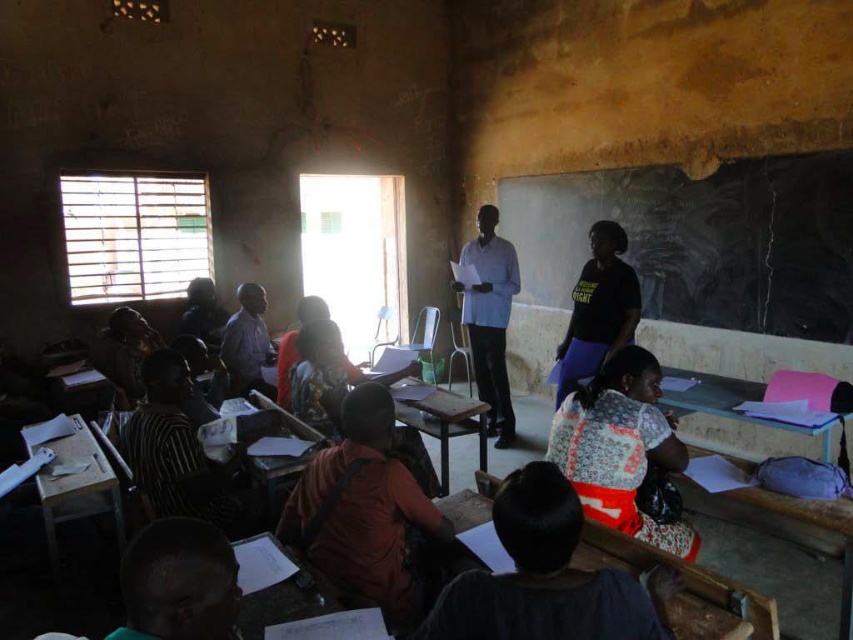
Question: Considering the real-world distances, which object is farthest from the white matte shirt at center?

Choices:
 (A) pink plastic table at lower right
 (B) white wooden table at lower left
 (C) black matte shirt at center
 (D) printed fabric shirt at lower center

Answer: (B)

Question: Is black chalkboard at upper center closer to camera compared to pink plastic table at lower right?

Choices:
 (A) yes
 (B) no

Answer: (B)

Question: Does black matte shirt at center have a larger size compared to pink plastic table at lower right?

Choices:
 (A) no
 (B) yes

Answer: (A)

Question: Considering the real-world distances, which object is closest to the black chalkboard at upper center?

Choices:
 (A) white wooden table at lower left
 (B) wooden table at center

Answer: (B)

Question: Which of the following is the closest to the observer?

Choices:
 (A) (791, 381)
 (B) (560, 452)
 (C) (440, 412)
 (D) (80, 436)

Answer: (B)

Question: Where is pink plastic table at lower right located in relation to wooden table at center in the image?

Choices:
 (A) right
 (B) left

Answer: (A)